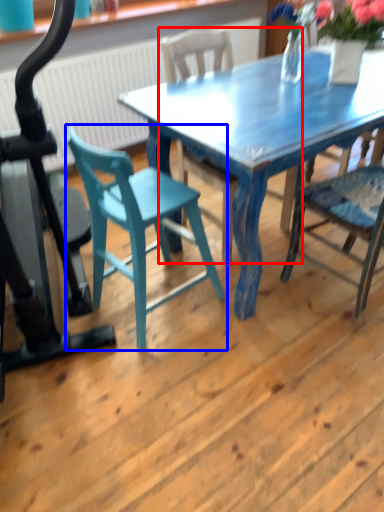
Question: Which point is closer to the camera, chair (highlighted by a red box) or chair (highlighted by a blue box)?

Choices:
 (A) chair
 (B) chair

Answer: (B)